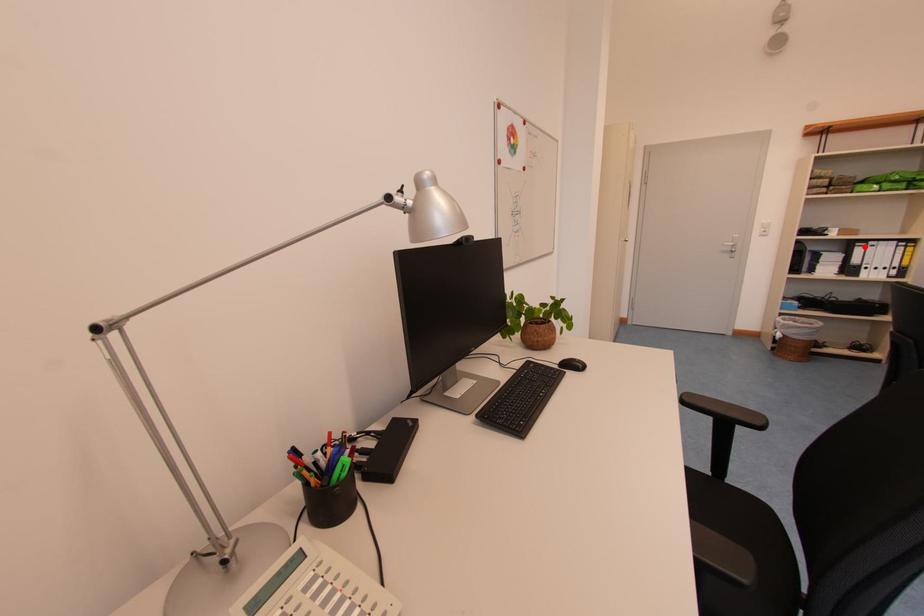
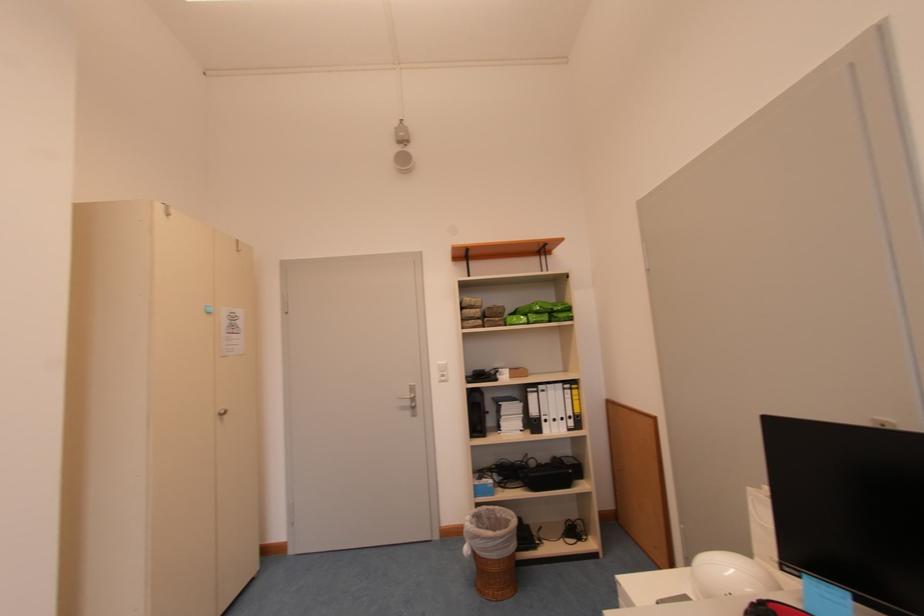
In the second image, find the point that corresponds to the highlighted location in the first image.

(536, 392)